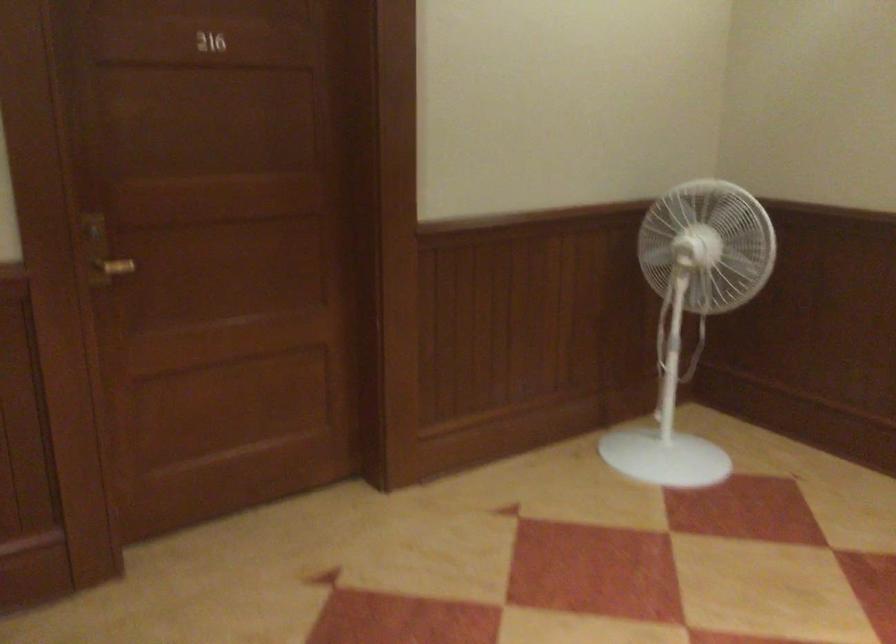
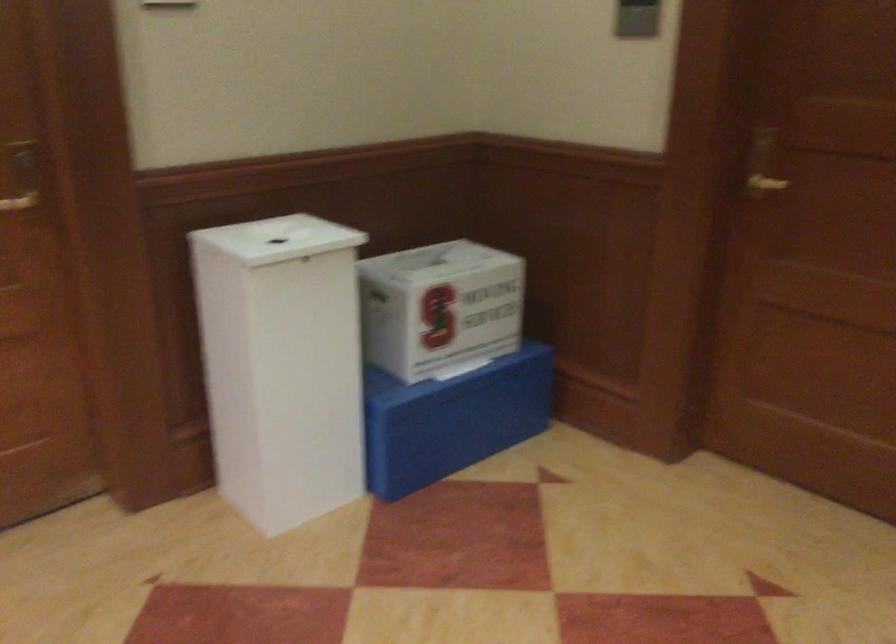
The point at (110, 249) is marked in the first image. Where is the corresponding point in the second image?

(762, 164)